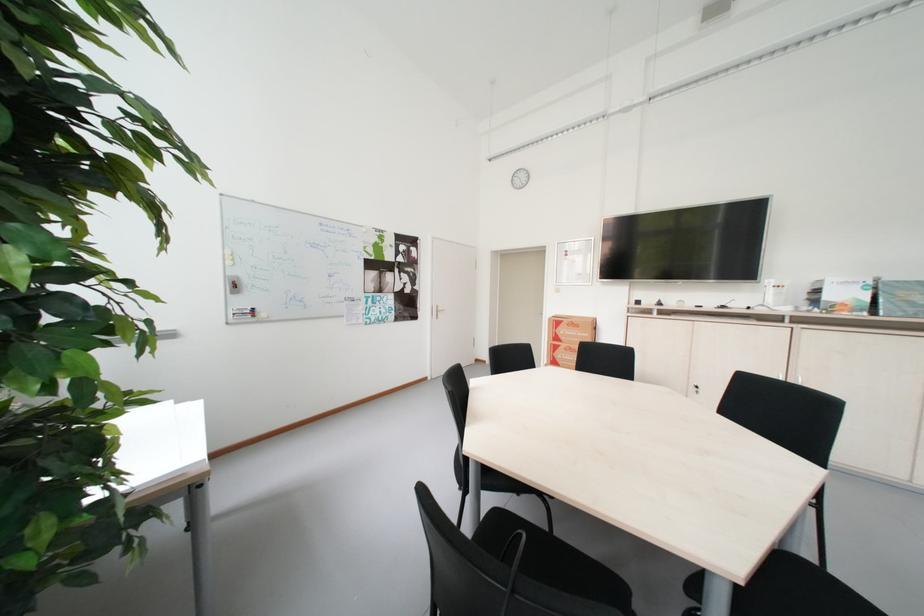
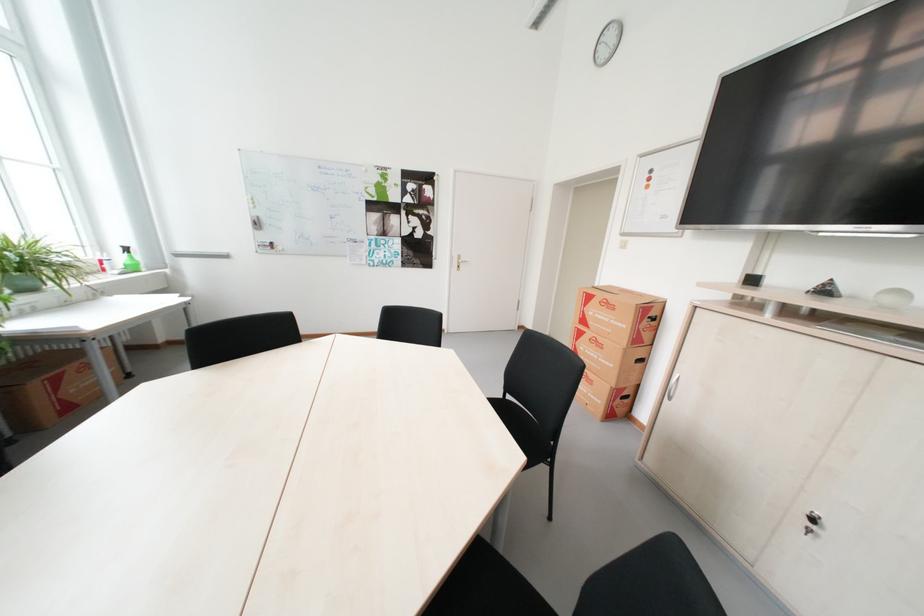
In the second image, find the point that corresponds to (669,305) in the first image.

(835, 292)